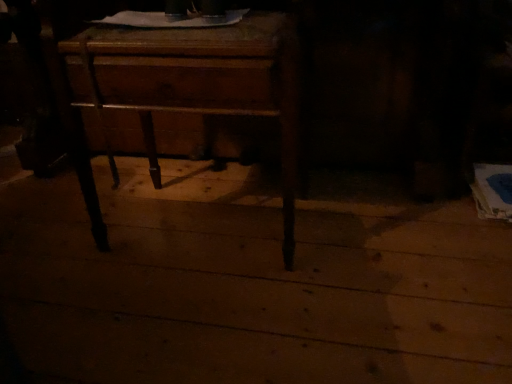
Find the location of a particular element. vacant area that is in front of wooden drawer at center is located at coordinates 198,319.